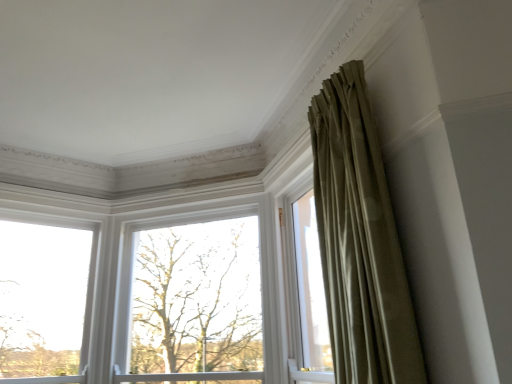
Question: Is clear glass window at left, which is the 1th window from left to right, next to bare branches at center and touching it?

Choices:
 (A) no
 (B) yes

Answer: (A)

Question: Is clear glass window at left, the 2th window when ordered from right to left, oriented towards bare branches at center?

Choices:
 (A) no
 (B) yes

Answer: (A)

Question: Is clear glass window at left, which is the 1th window from left to right, not close to bare branches at center?

Choices:
 (A) yes
 (B) no

Answer: (B)

Question: From a real-world perspective, is clear glass window at left, the 2th window when ordered from right to left, located higher than bare branches at center?

Choices:
 (A) yes
 (B) no

Answer: (A)

Question: Is clear glass window at left, the 2th window when ordered from right to left, oriented away from bare branches at center?

Choices:
 (A) yes
 (B) no

Answer: (B)

Question: Is silky olive drab curtain at upper right spatially inside clear glass window at left, the 2th window when ordered from right to left, or outside of it?

Choices:
 (A) inside
 (B) outside

Answer: (B)

Question: In the image, is silky olive drab curtain at upper right positioned in front of or behind clear glass window at left, the 2th window when ordered from right to left?

Choices:
 (A) front
 (B) behind

Answer: (A)

Question: From a real-world perspective, is silky olive drab curtain at upper right positioned above or below clear glass window at left, which is the 1th window from left to right?

Choices:
 (A) above
 (B) below

Answer: (A)

Question: From the image's perspective, relative to clear glass window at left, the 2th window when ordered from right to left, is silky olive drab curtain at upper right above or below?

Choices:
 (A) below
 (B) above

Answer: (B)

Question: Is point (166, 294) closer or farther from the camera than point (343, 357)?

Choices:
 (A) closer
 (B) farther

Answer: (B)

Question: Is bare branches at center taller or shorter than silky olive drab curtain at upper right?

Choices:
 (A) short
 (B) tall

Answer: (A)

Question: Is bare branches at center situated inside silky olive drab curtain at upper right or outside?

Choices:
 (A) inside
 (B) outside

Answer: (B)

Question: Looking at the image, does bare branches at center seem bigger or smaller compared to silky olive drab curtain at upper right?

Choices:
 (A) small
 (B) big

Answer: (B)

Question: Is clear glass window at left, the 2th window when ordered from right to left, to the left or to the right of bare branches at center in the image?

Choices:
 (A) right
 (B) left

Answer: (B)

Question: Is clear glass window at left, which is the 1th window from left to right, inside the boundaries of bare branches at center, or outside?

Choices:
 (A) inside
 (B) outside

Answer: (B)